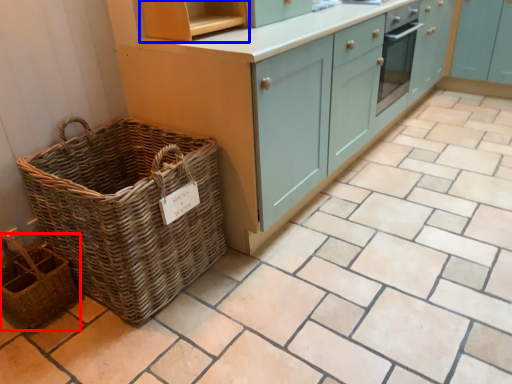
Question: Which point is closer to the camera, basket (highlighted by a red box) or shelf (highlighted by a blue box)?

Choices:
 (A) basket
 (B) shelf

Answer: (A)